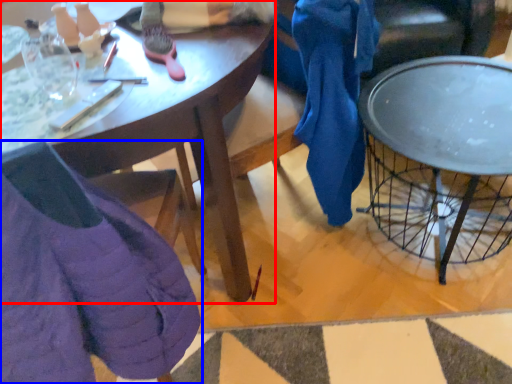
Question: Which object appears closest to the camera in this image, desk (highlighted by a red box) or chair (highlighted by a blue box)?

Choices:
 (A) desk
 (B) chair

Answer: (B)